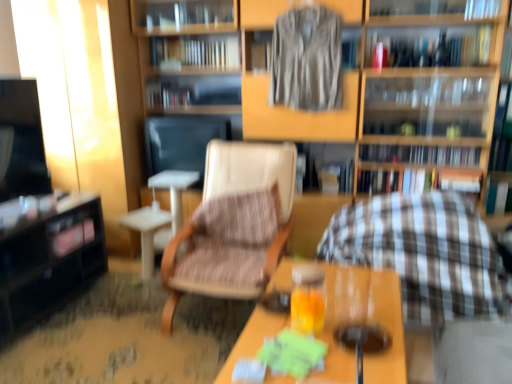
Where is `hardcover book at upper center, which appears as the sixth book when ordered from the bottom`? The image size is (512, 384). hardcover book at upper center, which appears as the sixth book when ordered from the bottom is located at coordinates (196, 52).

Locate an element on the screen. This screenshot has width=512, height=384. translucent glass beverage at center is located at coordinates (362, 337).

This screenshot has width=512, height=384. Find the location of `hardcover books at upper center, the 5th book viewed from the top`. hardcover books at upper center, the 5th book viewed from the top is located at coordinates (421, 154).

From a real-world perspective, who is located lower, black glossy table at left, acting as the first table starting from the left, or hardcover book at upper center, acting as the first book starting from the top?

In real-world perspective, black glossy table at left, acting as the first table starting from the left, is lower.

Is point (83, 231) positioned in front of point (161, 59)?

Yes.

Is black glossy table at left, acting as the first table starting from the left, taller than hardcover book at upper center, acting as the first book starting from the top?

Correct, black glossy table at left, acting as the first table starting from the left, is much taller as hardcover book at upper center, acting as the first book starting from the top.

Is point (387, 61) positioned before point (172, 48)?

Yes, point (387, 61) is in front of point (172, 48).

In the scene shown: Is hardcover book at upper right, placed as the 3th book when sorted from top to bottom, closer to camera compared to hardcover book at upper center, which appears as the sixth book when ordered from the bottom?

Yes, hardcover book at upper right, placed as the 3th book when sorted from top to bottom, is in front of hardcover book at upper center, which appears as the sixth book when ordered from the bottom.

From the picture: Is hardcover book at upper right, placed as the 3th book when sorted from top to bottom, touching hardcover book at upper center, which appears as the sixth book when ordered from the bottom?

hardcover book at upper right, placed as the 3th book when sorted from top to bottom, and hardcover book at upper center, which appears as the sixth book when ordered from the bottom, are clearly separated.

From the hardcover book at upper center, which appears as the sixth book when ordered from the bottom, count 2nd book to the right and point to it. Please provide its 2D coordinates.

[(432, 48)]

Which object is thinner, hardcover book at center, the 3th book ordered from the bottom, or hardcover book at upper right, positioned as the fourth book in bottom-to-top order?

Thinner between the two is hardcover book at center, the 3th book ordered from the bottom.

From the image's perspective, is hardcover book at center, the 3th book ordered from the bottom, above or below hardcover book at upper right, positioned as the fourth book in bottom-to-top order?

hardcover book at center, the 3th book ordered from the bottom, is below hardcover book at upper right, positioned as the fourth book in bottom-to-top order.

From a real-world perspective, which book is the 1st one underneath the hardcover book at upper right, positioned as the fourth book in bottom-to-top order? Please provide its 2D coordinates.

[(176, 97)]

Based on their sizes in the image, would you say brown textured rocking chair at center is bigger or smaller than translucent glass beverage at center?

brown textured rocking chair at center is bigger than translucent glass beverage at center.

Is brown textured rocking chair at center oriented away from translucent glass beverage at center?

No, brown textured rocking chair at center is not facing away from translucent glass beverage at center.

Considering the relative positions of brown textured rocking chair at center and translucent glass beverage at center in the image provided, is brown textured rocking chair at center to the left of translucent glass beverage at center from the viewer's perspective?

In fact, brown textured rocking chair at center is to the right of translucent glass beverage at center.

Are brown textured rocking chair at center and translucent glass beverage at center making contact?

No, brown textured rocking chair at center is not in contact with translucent glass beverage at center.

Considering the sizes of objects wooden bookshelf at center and hardcover book at upper right, positioned as the fourth book in bottom-to-top order, in the image provided, who is taller, wooden bookshelf at center or hardcover book at upper right, positioned as the fourth book in bottom-to-top order,?

wooden bookshelf at center is taller.

From the image's perspective, between wooden bookshelf at center and hardcover book at upper right, placed as the 3th book when sorted from top to bottom, who is located below?

From the image's view, wooden bookshelf at center is below.

From a real-world perspective, is wooden bookshelf at center located beneath hardcover book at upper right, positioned as the fourth book in bottom-to-top order?

Yes.

Is wooden bookshelf at center beside hardcover book at upper right, positioned as the fourth book in bottom-to-top order?

No, wooden bookshelf at center is not next to hardcover book at upper right, positioned as the fourth book in bottom-to-top order.

Is translucent glass beverage at center positioned beyond the bounds of black glossy table at left, acting as the first table starting from the left?

Yes, translucent glass beverage at center is outside of black glossy table at left, acting as the first table starting from the left.

Between translucent glass beverage at center and black glossy table at left, the second table from the front, which one has larger size?

black glossy table at left, the second table from the front, is bigger.

Does translucent glass beverage at center have a lesser height compared to black glossy table at left, the second table from the front?

Yes.

From a real-world perspective, is translucent glass beverage at center over black glossy table at left, acting as the first table starting from the left?

Indeed, from a real-world perspective, translucent glass beverage at center stands above black glossy table at left, acting as the first table starting from the left.

Is hardcover book at center, which is the 1th book from bottom to top, smaller than wooden bookshelf at center?

Yes, hardcover book at center, which is the 1th book from bottom to top, is smaller than wooden bookshelf at center.

Considering the relative sizes of hardcover book at center, the 6th book when ordered from top to bottom, and wooden bookshelf at center in the image provided, is hardcover book at center, the 6th book when ordered from top to bottom, shorter than wooden bookshelf at center?

Correct, hardcover book at center, the 6th book when ordered from top to bottom, is not as tall as wooden bookshelf at center.

Choose the correct answer: Is hardcover book at center, the 6th book when ordered from top to bottom, inside wooden bookshelf at center or outside it?

hardcover book at center, the 6th book when ordered from top to bottom, is spatially positioned inside wooden bookshelf at center.

From a real-world perspective, which table is the 1st one underneath the hardcover book at upper center, acting as the first book starting from the top? Please provide its 2D coordinates.

[(49, 261)]

Identify the location of the 2nd book above the hardcover book at upper right, positioned as the fourth book in bottom-to-top order (from the image's perspective). (196, 52).

Which object lies nearer to the anchor point hardcover books at upper center, acting as the 2th book starting from the bottom, hardcover book at center, the 6th book when ordered from top to bottom, or striped fabric book at center, positioned as the 2th book in top-to-bottom order?

hardcover book at center, the 6th book when ordered from top to bottom, is positioned closer to the anchor hardcover books at upper center, acting as the 2th book starting from the bottom.

Estimate the real-world distances between objects in this image. Which object is closer to hardcover book at upper right, placed as the 3th book when sorted from top to bottom, wooden bookshelf at center or wooden table at center, which is the 2th table from left to right?

wooden bookshelf at center.

Considering their positions, is hardcover book at upper center, acting as the first book starting from the top, positioned closer to brown textured rocking chair at center than hardcover book at center, the 6th book when ordered from top to bottom?

hardcover book at center, the 6th book when ordered from top to bottom.

When comparing their distances from translucent glass beverage at center, does hardcover book at upper center, acting as the first book starting from the top, or hardcover book at center, the 6th book when ordered from top to bottom, seem closer?

Based on the image, hardcover book at center, the 6th book when ordered from top to bottom, appears to be nearer to translucent glass beverage at center.

Based on their spatial positions, is translucent glass beverage at center or silky brown shirt at upper center further from hardcover book at center, the 6th book when ordered from top to bottom?

translucent glass beverage at center.

Which object lies nearer to the anchor point translucent glass beverage at center, silky brown shirt at upper center or hardcover book at upper right, placed as the 3th book when sorted from top to bottom?

Among the two, silky brown shirt at upper center is located nearer to translucent glass beverage at center.

Estimate the real-world distances between objects in this image. Which object is further from hardcover book at upper center, which appears as the sixth book when ordered from the bottom, hardcover book at upper right, placed as the 3th book when sorted from top to bottom, or hardcover book at center, the 3th book ordered from the bottom?

hardcover book at upper right, placed as the 3th book when sorted from top to bottom, lies further to hardcover book at upper center, which appears as the sixth book when ordered from the bottom, than the other object.

Based on their spatial positions, is hardcover book at center, acting as the fourth book starting from the top, or brown leather chair at center further from wooden bookshelf at center?

hardcover book at center, acting as the fourth book starting from the top, is further to wooden bookshelf at center.

Locate an element on the screen. This screenshot has width=512, height=384. beverage between wooden table at center, the 1th table positioned from the front, and hardcover books at upper center, the 5th book viewed from the top, in the front-back direction is located at coordinates (362, 337).

I want to click on shelf between brown leather chair at center and hardcover books at upper center, acting as the 2th book starting from the bottom, in the horizontal direction, so click(388, 78).

Where is `beverage between wooden table at center, the 1th table viewed from the right, and brown leather chair at center in the front-back direction`? beverage between wooden table at center, the 1th table viewed from the right, and brown leather chair at center in the front-back direction is located at coordinates (362, 337).

Identify the location of clothing between hardcover book at upper center, which appears as the sixth book when ordered from the bottom, and hardcover book at center, which is the 1th book from bottom to top. (307, 60).